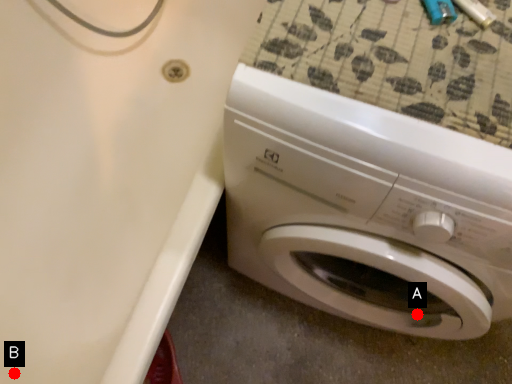
Question: Two points are circled on the image, labeled by A and B beside each circle. Which point is farther to the camera?

Choices:
 (A) A is further
 (B) B is further

Answer: (B)